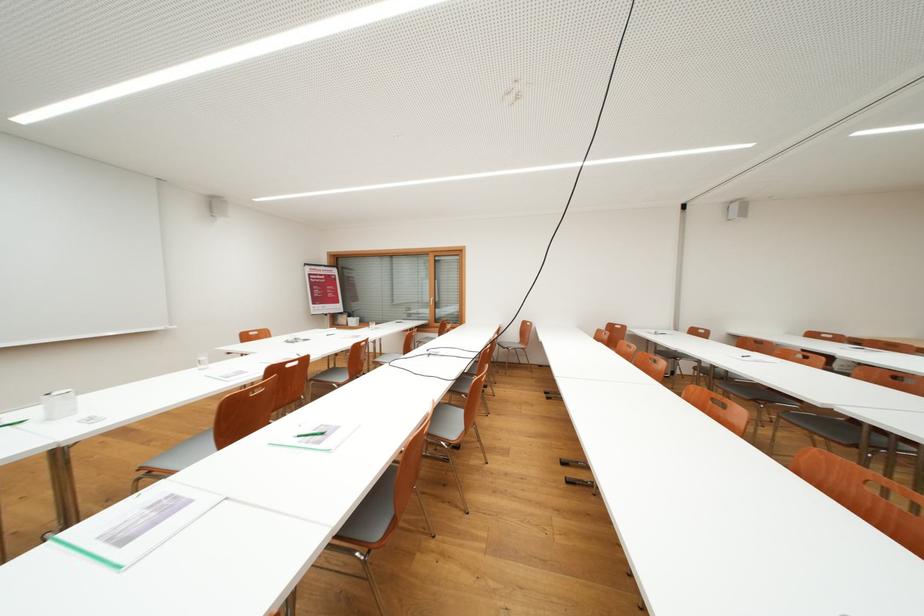
The height and width of the screenshot is (616, 924). What do you see at coordinates (138, 524) in the screenshot?
I see `a whiteboard marker tray` at bounding box center [138, 524].